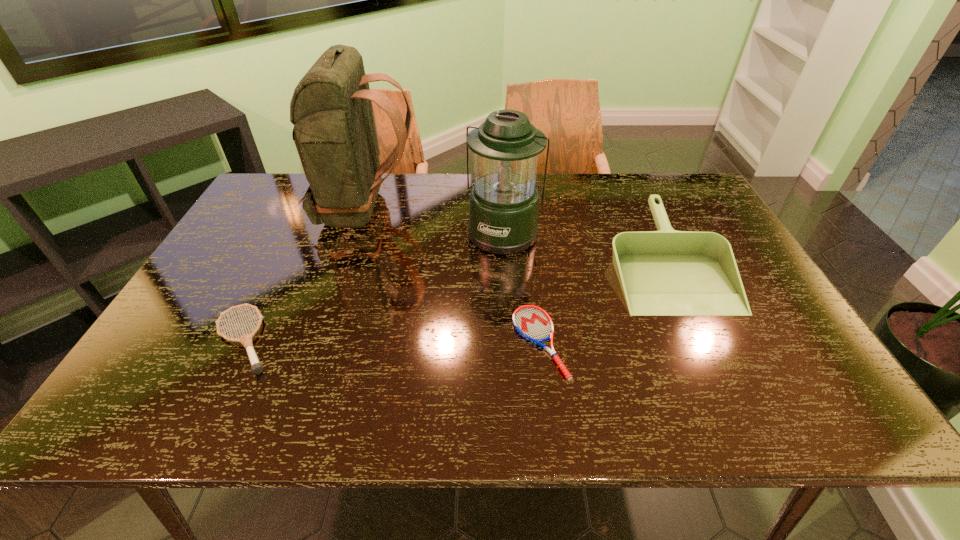
The width and height of the screenshot is (960, 540). In order to click on free space located 0.130m on the scoop of the rightmost object in this screenshot , I will do `click(712, 360)`.

Identify the location of vacant space located on the back of the taller tennis racket. (300, 227).

Identify the location of vacant space located 0.170m on the left of the shorter tennis racket. (439, 342).

This screenshot has width=960, height=540. What are the coordinates of `backpack that is at the far edge` in the screenshot? It's located at (334, 131).

Locate an element on the screen. The image size is (960, 540). lantern present at the far edge is located at coordinates (504, 203).

I want to click on object present at the left edge, so click(x=246, y=340).

Identify the location of object that is at the right edge. (666, 272).

Find the location of a particular element. The height and width of the screenshot is (540, 960). vacant region at the far edge is located at coordinates (627, 190).

Where is `free space at the near edge`? Image resolution: width=960 pixels, height=540 pixels. free space at the near edge is located at coordinates (664, 393).

The image size is (960, 540). What are the coordinates of `vacant region at the left edge of the desktop` in the screenshot? It's located at (256, 231).